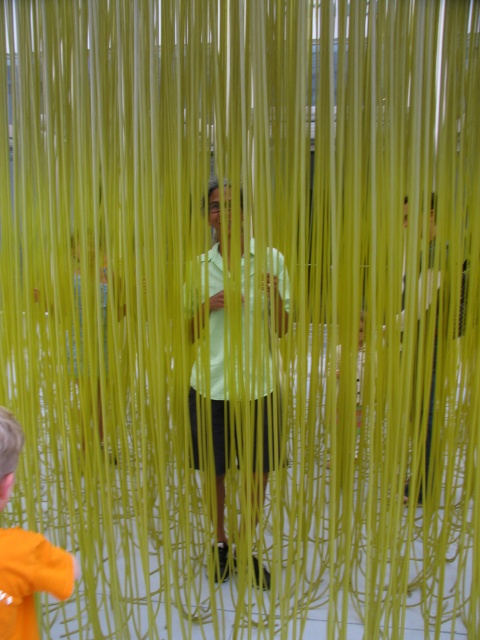
Question: Which object is farther from the camera taking this photo?

Choices:
 (A) light green fabric at center
 (B) light green fabric shirt at center
 (C) orange fabric at lower left

Answer: (B)

Question: Can you confirm if light green fabric at center is positioned to the left of light green fabric shirt at center?

Choices:
 (A) yes
 (B) no

Answer: (B)

Question: Is light green fabric at center below light green fabric shirt at center?

Choices:
 (A) no
 (B) yes

Answer: (B)

Question: Which of the following is the closest to the observer?

Choices:
 (A) (228, 339)
 (B) (4, 476)

Answer: (B)

Question: Which point is closer to the camera?

Choices:
 (A) light green fabric shirt at center
 (B) light green fabric at center
 (C) orange fabric at lower left

Answer: (C)

Question: Does light green fabric shirt at center appear on the left side of orange fabric at lower left?

Choices:
 (A) yes
 (B) no

Answer: (B)